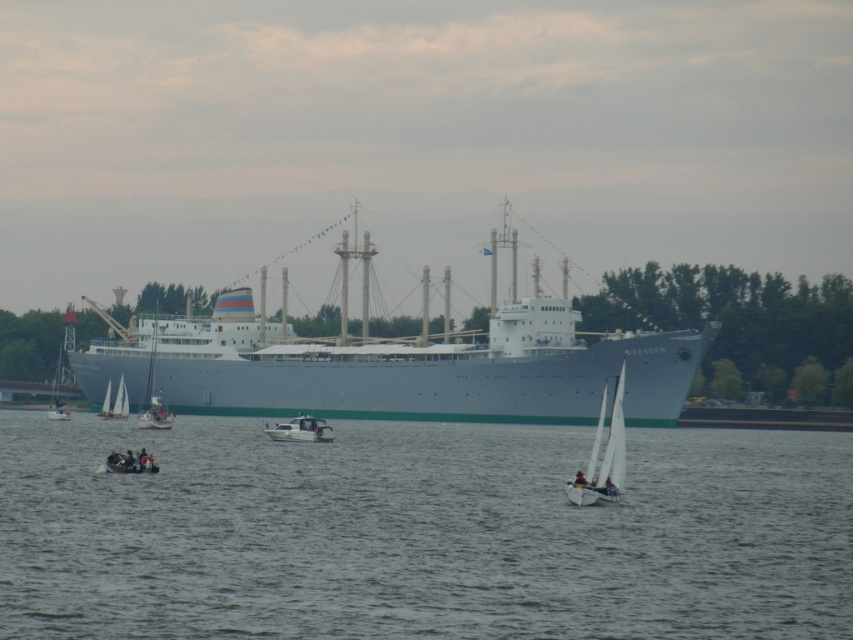
Question: Which point is farther from the camera taking this photo?

Choices:
 (A) (56, 371)
 (B) (695, 518)

Answer: (A)

Question: Can you confirm if gray water at center is positioned to the right of matte gray ship at center?

Choices:
 (A) no
 (B) yes

Answer: (B)

Question: Does white sailboat at left have a lesser width compared to white sailboat at lower left?

Choices:
 (A) yes
 (B) no

Answer: (B)

Question: Is white plastic boat at lower left positioned behind white sailboat at lower left?

Choices:
 (A) no
 (B) yes

Answer: (A)

Question: Which point appears closest to the camera in this image?

Choices:
 (A) 563,355
 (B) 285,422
 (C) 616,410

Answer: (C)

Question: Among these points, which one is farthest from the camera?

Choices:
 (A) (51, 397)
 (B) (97, 413)
 (C) (590, 465)
 (D) (508, 401)

Answer: (A)